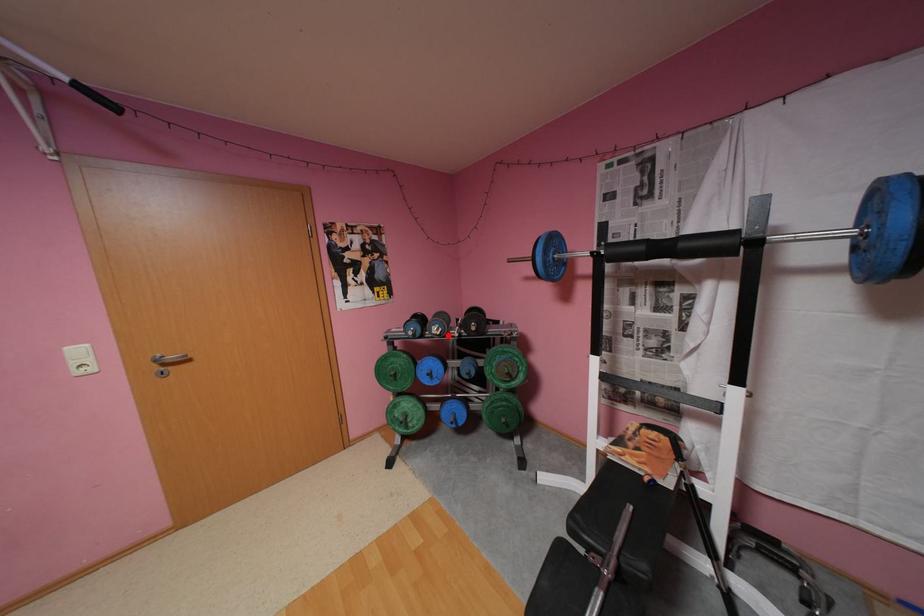
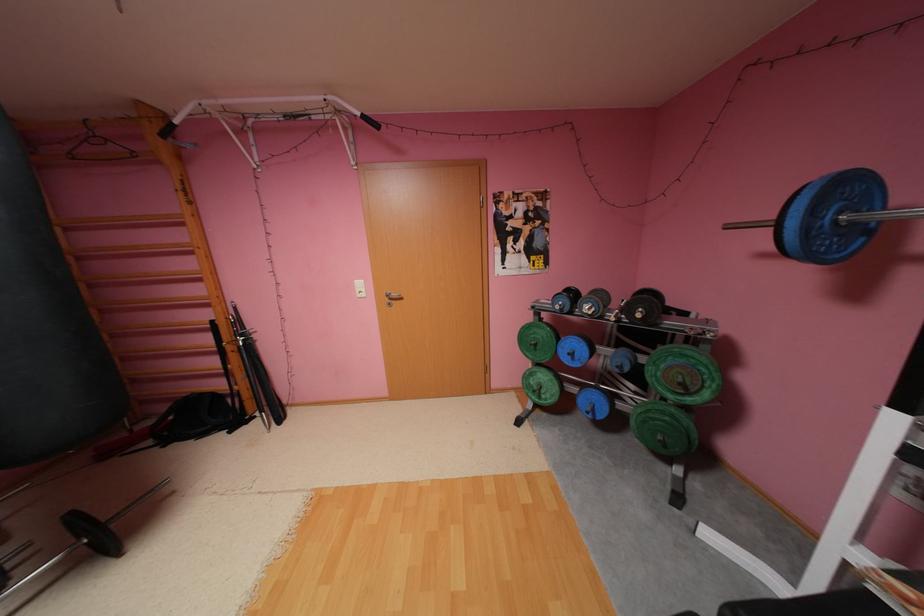
Where in the second image is the point corresponding to the highlighted location from the first image?

(600, 315)